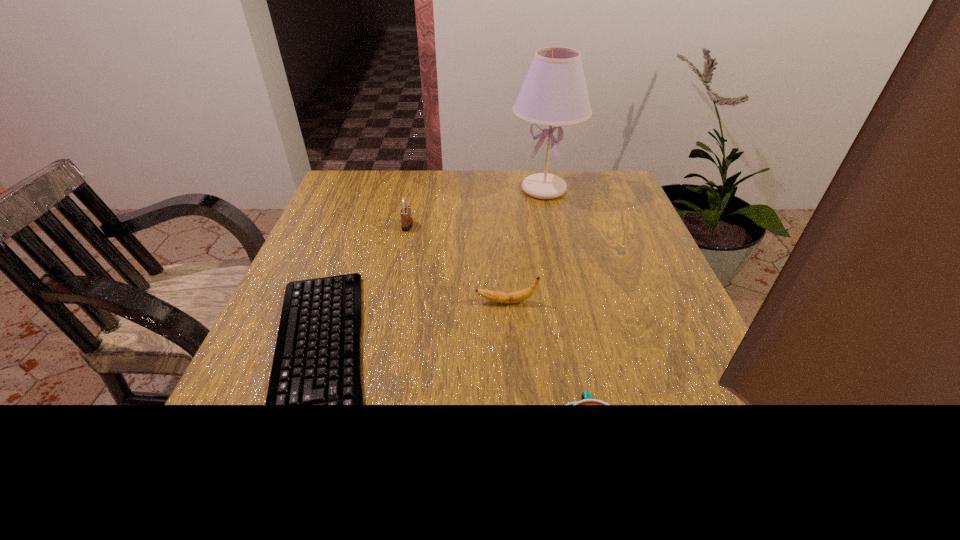
You are a GUI agent. You are given a task and a screenshot of the screen. Output one action in this format:
    pyautogui.click(x=<x>, y=<y>)
    Task: Click on the vacant area that satisfies the following two spatial constraints: 1. on the front side of the farthest object; 2. on the peel of the banana from the top
    
    Given the screenshot: What is the action you would take?
    pyautogui.click(x=568, y=302)

This screenshot has height=540, width=960. Identify the location of free space that satisfies the following two spatial constraints: 1. on the peel of the banana from the top; 2. with the handle on the right side of the cappuccino. (516, 449).

In order to click on blank space that satisfies the following two spatial constraints: 1. with the handle on the right side of the cappuccino; 2. on the peel of the banana from the top in this screenshot , I will do `click(560, 302)`.

You are a GUI agent. You are given a task and a screenshot of the screen. Output one action in this format:
    pyautogui.click(x=<x>, y=<y>)
    Task: Click on the vacant position in the image that satisfies the following two spatial constraints: 1. on the peel of the banana from the top; 2. with the handle on the right side of the cappuccino
    Image resolution: width=960 pixels, height=540 pixels.
    Given the screenshot: What is the action you would take?
    pyautogui.click(x=516, y=449)

The width and height of the screenshot is (960, 540). Identify the location of blank area in the image that satisfies the following two spatial constraints: 1. on the back side of the shortest object; 2. on the right side of the padlock. (367, 226).

Identify the location of vacant area that satisfies the following two spatial constraints: 1. on the peel of the banana from the top; 2. with the handle on the right side of the cappuccino. The height and width of the screenshot is (540, 960). (516, 449).